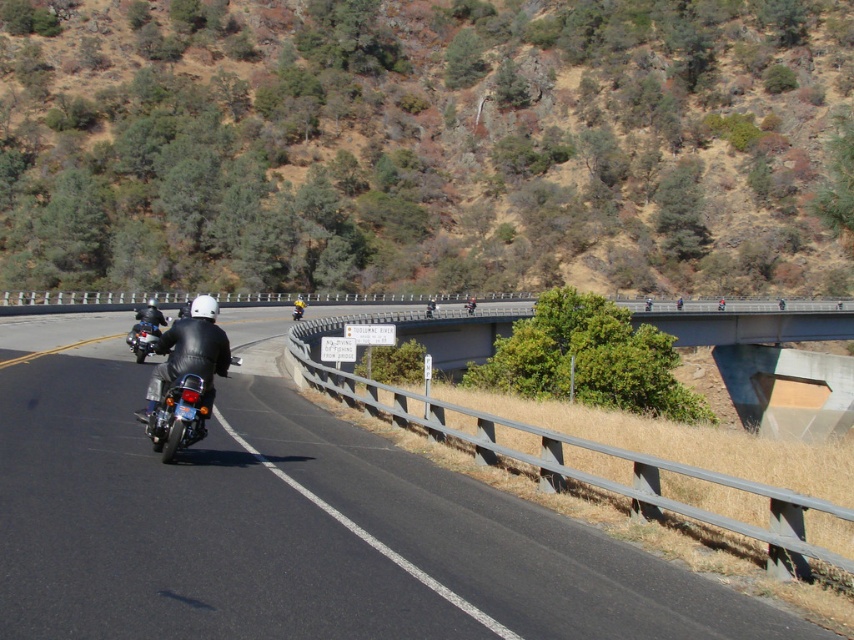
You are a photographer trying to capture the motorcyclist in the scene. Since the black asphalt road at center and the shiny black leather jacket at center are both in the frame, which object should you focus on first to ensure the motorcyclist is in sharp focus?

The black asphalt road at center is closer to the viewer than the shiny black leather jacket at center. To ensure the motorcyclist is in sharp focus, you should focus on the black asphalt road at center first.

You are a photographer planning to capture a wide shot of the concrete bridge at upper center and the shiny chrome motorcycle at left. Given their sizes, which object should you frame first to ensure both are fully visible in the shot?

The concrete bridge at upper center is wider than the shiny chrome motorcycle at left, so you should frame the concrete bridge at upper center first to accommodate its larger size, ensuring both objects fit in the shot.